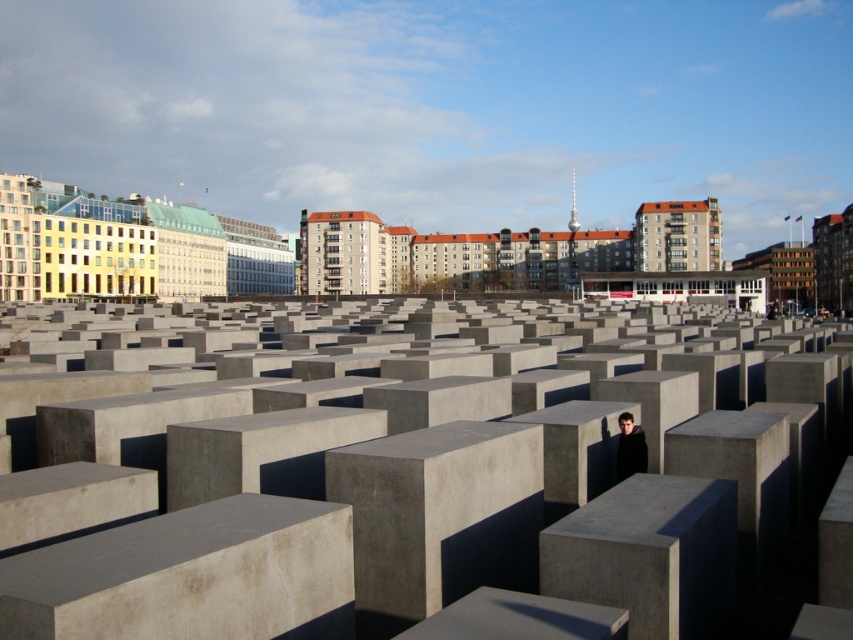
Question: Is smooth gray concrete blocks at center below black matte jacket at center?

Choices:
 (A) no
 (B) yes

Answer: (A)

Question: Does smooth gray concrete blocks at center appear on the left side of black matte jacket at center?

Choices:
 (A) no
 (B) yes

Answer: (B)

Question: Among these points, which one is farthest from the camera?

Choices:
 (A) (641, 456)
 (B) (647, 488)

Answer: (A)

Question: Can you confirm if smooth gray concrete blocks at center is positioned to the left of black matte jacket at center?

Choices:
 (A) no
 (B) yes

Answer: (B)

Question: Which of the following is the farthest from the observer?

Choices:
 (A) smooth gray concrete blocks at center
 (B) black matte jacket at center

Answer: (B)

Question: Which of the following is the closest to the observer?

Choices:
 (A) smooth gray concrete blocks at center
 (B) black matte jacket at center

Answer: (A)